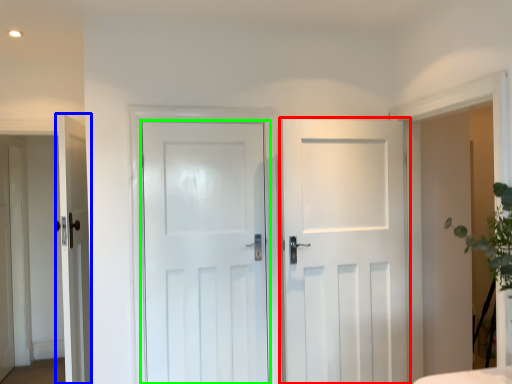
Question: Based on their relative distances, which object is nearer to door (highlighted by a red box)? Choose from door (highlighted by a blue box) and door (highlighted by a green box).

Choices:
 (A) door
 (B) door

Answer: (B)